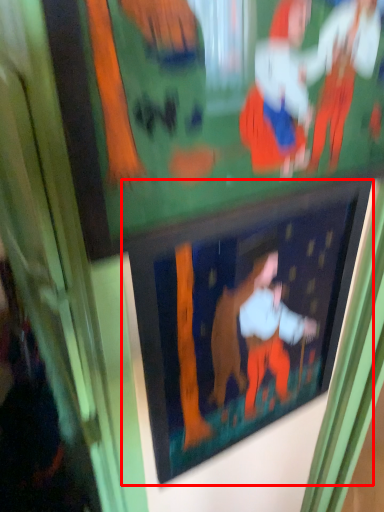
Question: From the image's perspective, where is picture frame (annotated by the red box) located in relation to bulletin board in the image?

Choices:
 (A) below
 (B) above

Answer: (A)